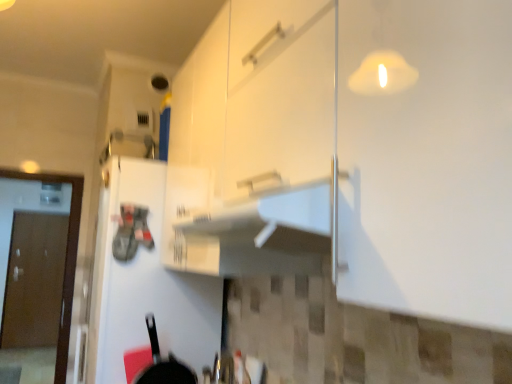
Question: Is white matte refrigerator at left, acting as the 2th door starting from the left, spatially inside brown matte door at left, which is counted as the 1th door, starting from the back, or outside of it?

Choices:
 (A) outside
 (B) inside

Answer: (A)

Question: Is white matte refrigerator at left, the 2th door positioned from the back, bigger or smaller than brown matte door at left, which is counted as the 1th door, starting from the back?

Choices:
 (A) small
 (B) big

Answer: (B)

Question: Which object is the farthest from the white matte refrigerator at left, the 2th door positioned from the back?

Choices:
 (A) black matte frying pan at lower left
 (B) brown matte door at left, which ranks as the 2th door in right-to-left order

Answer: (B)

Question: Which object is positioned closest to the white matte refrigerator at left, positioned as the first door in right-to-left order?

Choices:
 (A) black matte frying pan at lower left
 (B) brown matte door at left, which is the 2th door in front-to-back order

Answer: (A)